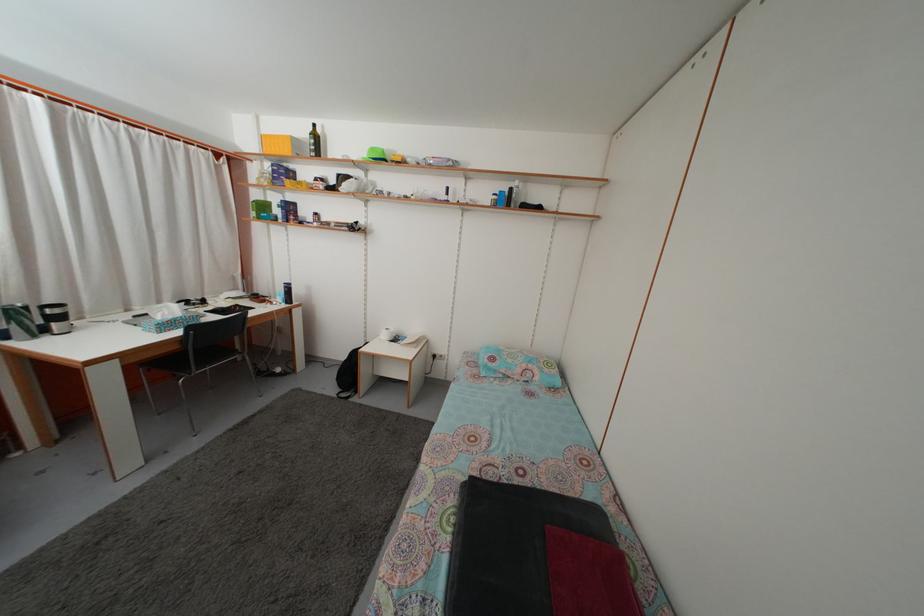
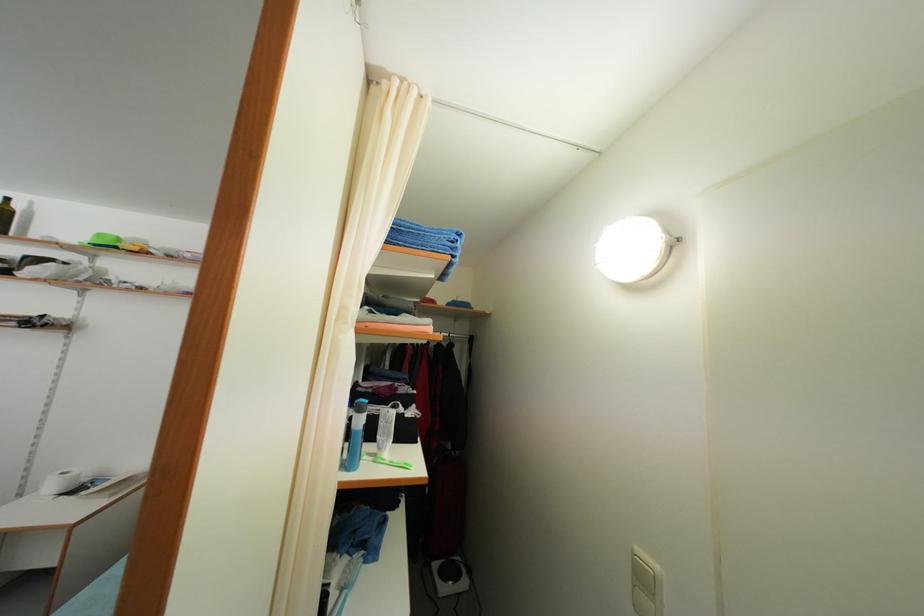
Where in the second image is the point corresponding to pixel 379 156 from the first image?

(104, 243)